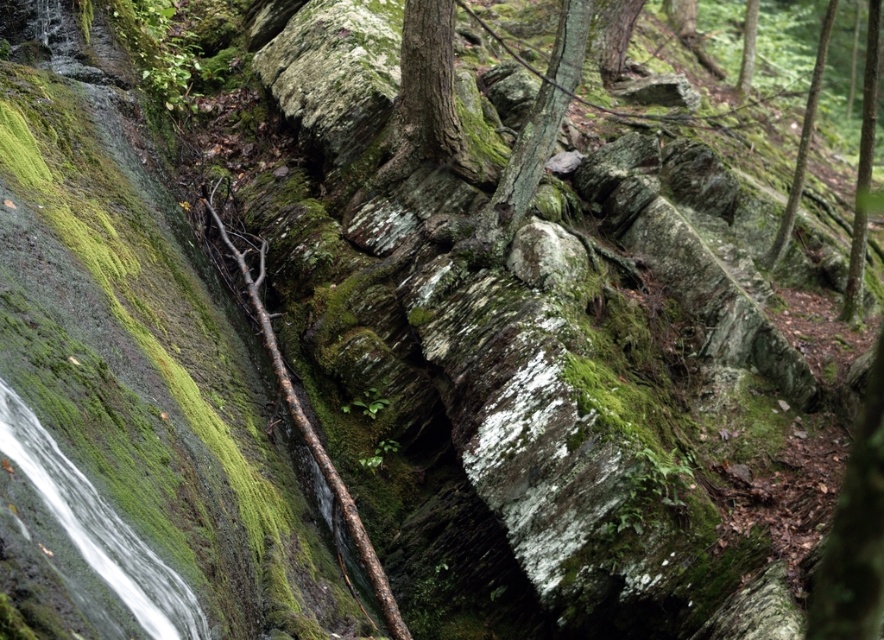
Does green mossy tree trunk at center appear on the right side of green mossy bark tree at right?

No, green mossy tree trunk at center is not to the right of green mossy bark tree at right.

Describe the element at coordinates (531, 141) in the screenshot. I see `green mossy tree trunk at center` at that location.

Is point (543, 144) positioned after point (863, 124)?

No, it is not.

In order to click on green mossy tree trunk at center in this screenshot , I will do `click(531, 141)`.

Is green mossy tree trunk at center taller than green mossy tree at upper right?

Incorrect, green mossy tree trunk at center's height is not larger of green mossy tree at upper right's.

From the picture: Who is positioned more to the right, green mossy tree trunk at center or green mossy tree at upper right?

Positioned to the right is green mossy tree at upper right.

Measure the distance between point (554, 129) and camera.

Point (554, 129) and camera are 12.10 meters apart from each other.

Image resolution: width=884 pixels, height=640 pixels. In order to click on green mossy tree trunk at center in this screenshot , I will do `click(531, 141)`.

The image size is (884, 640). I want to click on smooth bark tree at center, so click(x=427, y=97).

Does smooth bark tree at center come in front of green mossy tree at upper right?

That is True.

Which is in front, point (425, 0) or point (770, 257)?

Point (425, 0) is in front.

At what (x,y) coordinates should I click in order to perform the action: click on smooth bark tree at center. Please return your answer as a coordinate pair (x, y). Looking at the image, I should click on (427, 97).